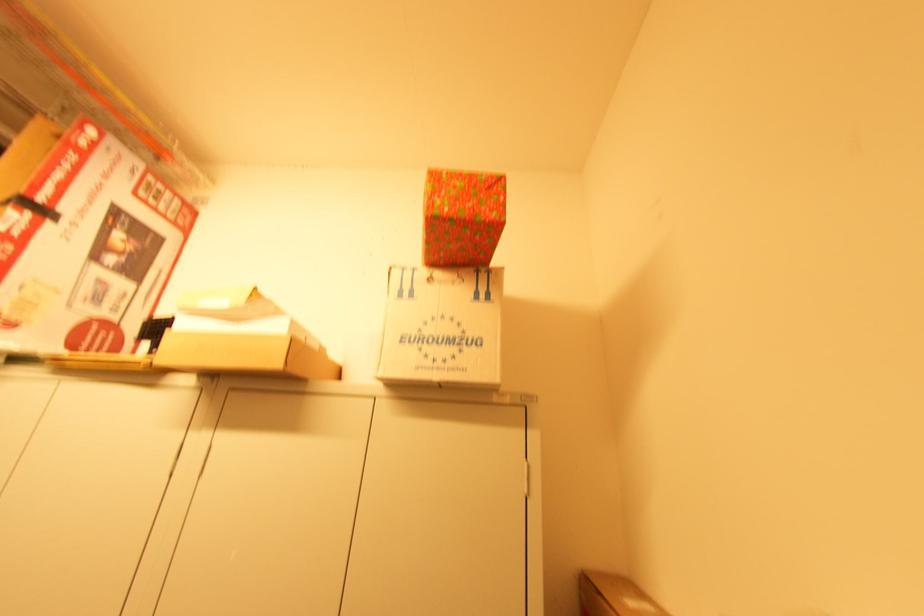
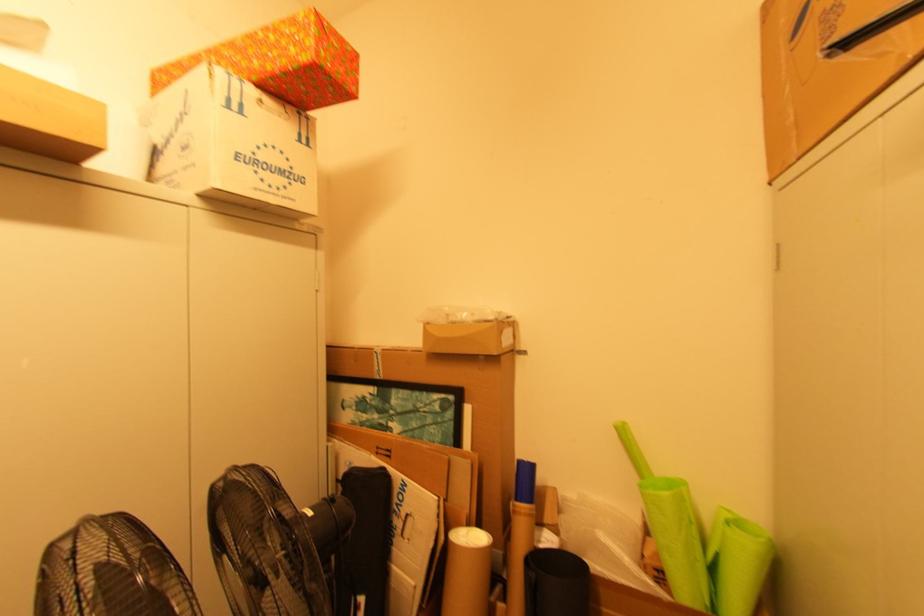
Question: How did the camera likely rotate?

Choices:
 (A) Left
 (B) Right
 (C) Up
 (D) Down

Answer: (B)